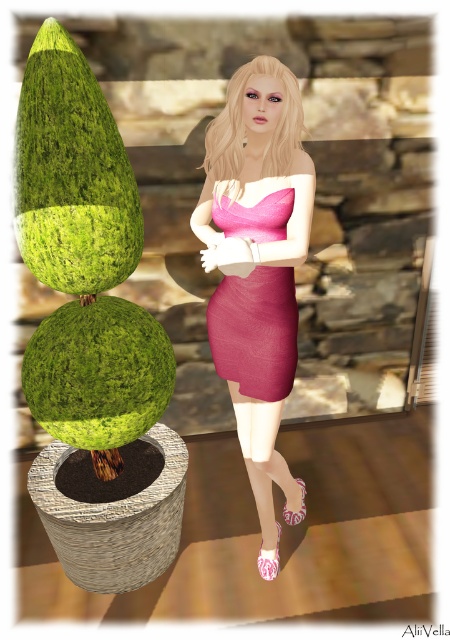
You are a fashion designer observing the image and want to create a new outfit. Which dress, the pink satin dress at center or the pink matte dress at center, is more visible to you from your current viewpoint?

The pink satin dress at center is more visible because it is in front of the pink matte dress at center.